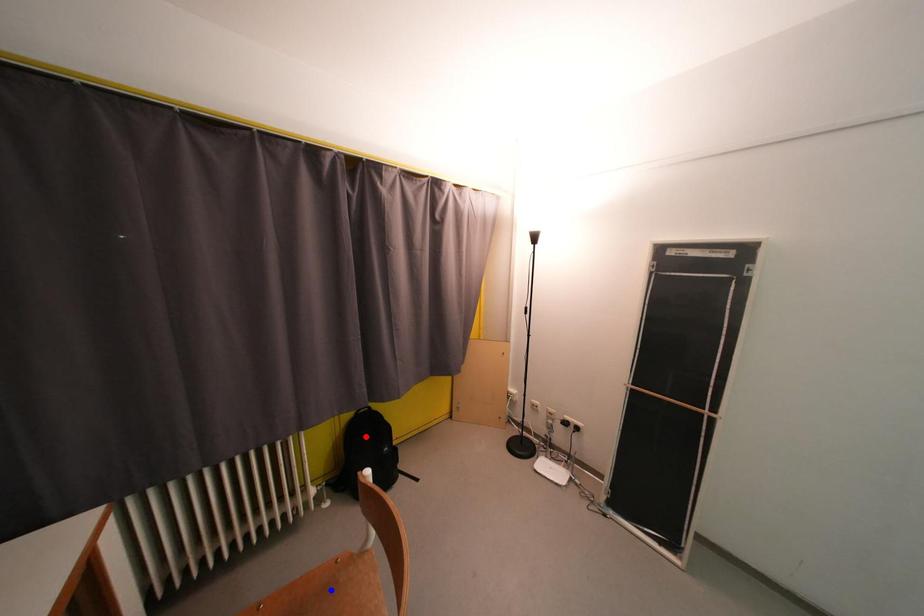
Question: Which of the two points in the image is closer to the camera?

Choices:
 (A) Blue point is closer.
 (B) Red point is closer.

Answer: (A)